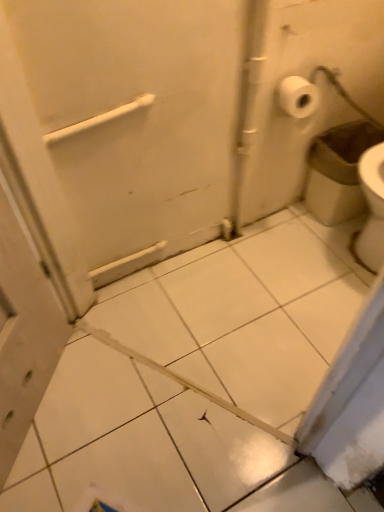
Question: From a real-world perspective, is white plastic towel bar at upper center above or below white plastic trash can at right?

Choices:
 (A) above
 (B) below

Answer: (A)

Question: Looking at their shapes, would you say white plastic towel bar at upper center is wider or thinner than white plastic trash can at right?

Choices:
 (A) wide
 (B) thin

Answer: (B)

Question: From the image's perspective, is white plastic towel bar at upper center above or below white plastic trash can at right?

Choices:
 (A) below
 (B) above

Answer: (B)

Question: Does point (342, 182) appear closer or farther from the camera than point (92, 126)?

Choices:
 (A) closer
 (B) farther

Answer: (B)

Question: Is white plastic trash can at right wider or thinner than white plastic towel bar at upper center?

Choices:
 (A) wide
 (B) thin

Answer: (A)

Question: In the image, is white plastic trash can at right on the left side or the right side of white plastic towel bar at upper center?

Choices:
 (A) left
 (B) right

Answer: (B)

Question: Considering the positions of white plastic trash can at right and white plastic towel bar at upper center in the image, is white plastic trash can at right bigger or smaller than white plastic towel bar at upper center?

Choices:
 (A) small
 (B) big

Answer: (B)